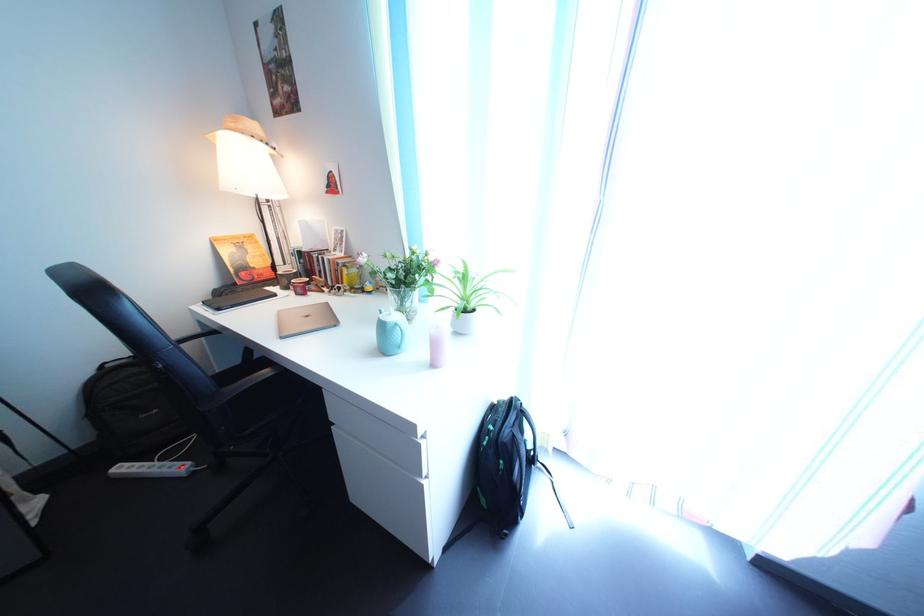
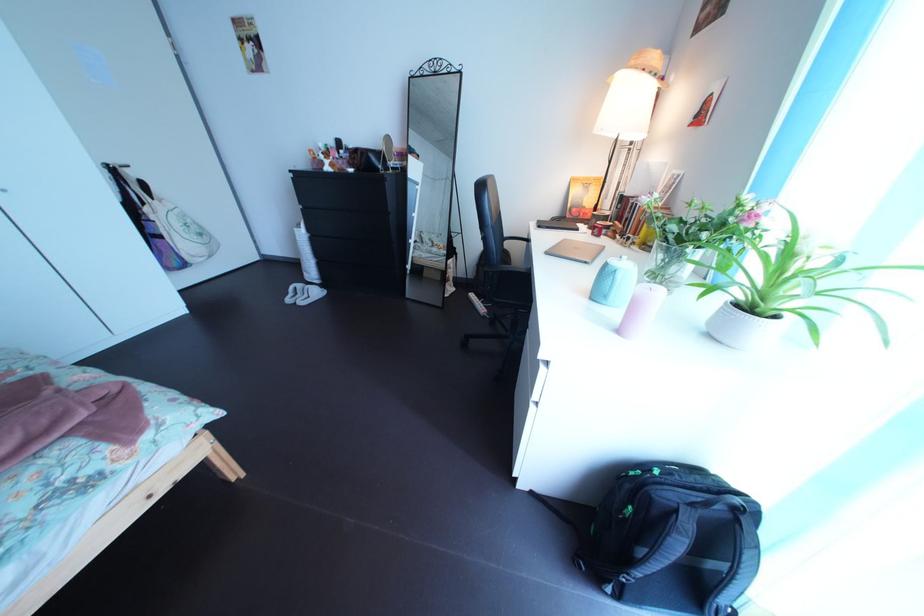
Locate, in the second image, the point that corresponds to pixel 412 355 in the first image.

(621, 305)